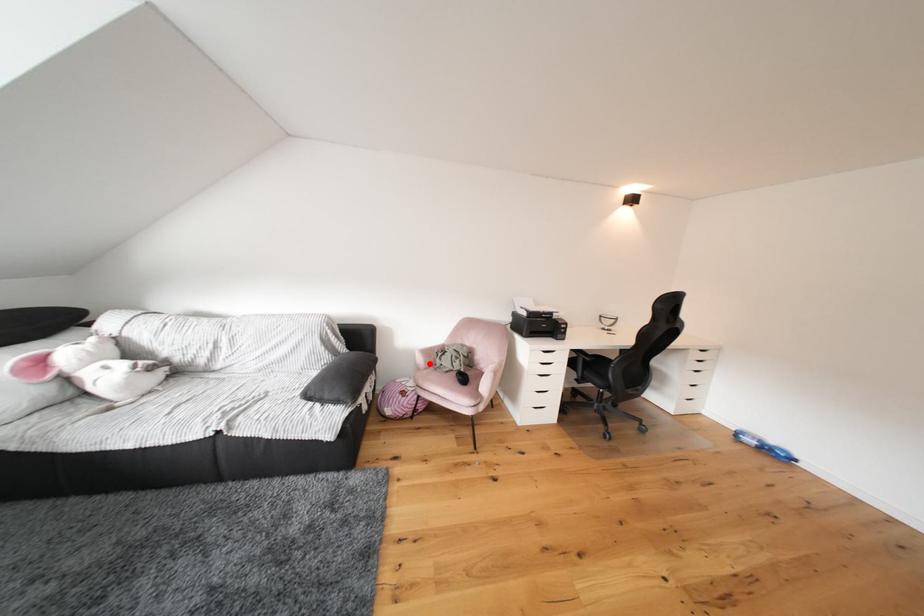
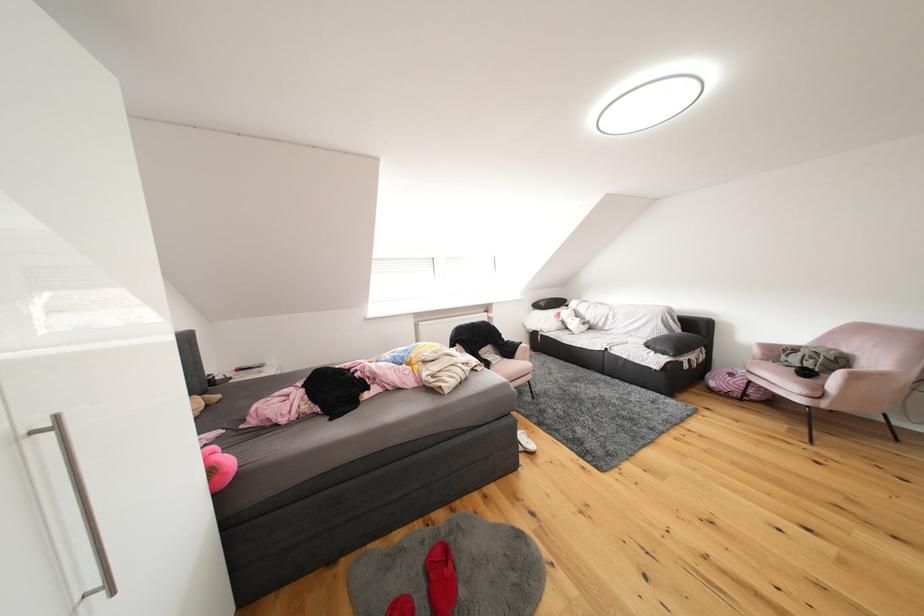
Question: A red point is marked in image1. In image2, is the corresponding 3D point closer to the camera or farther? Reply with the corresponding letter.

Choices:
 (A) The corresponding 3D point is closer.
 (B) The corresponding 3D point is farther.

Answer: (A)